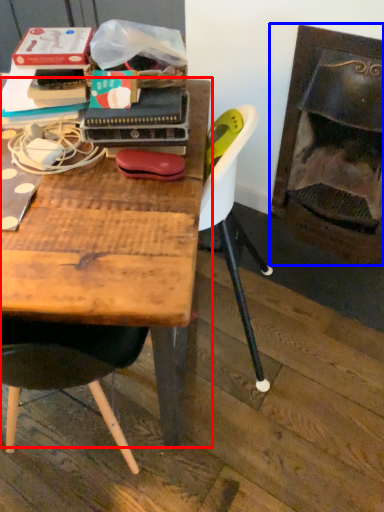
Question: Which object is closer to the camera taking this photo, table (highlighted by a red box) or fireplace (highlighted by a blue box)?

Choices:
 (A) table
 (B) fireplace

Answer: (A)